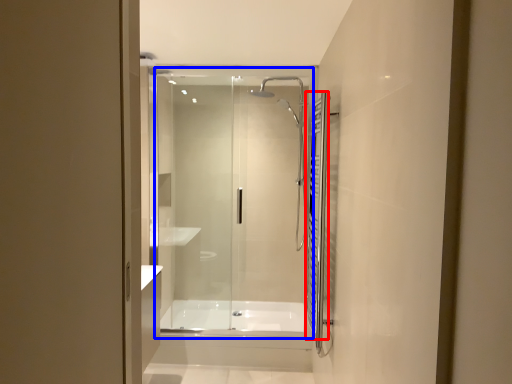
Question: Among these objects, which one is nearest to the camera, shower curtain (highlighted by a red box) or glass door (highlighted by a blue box)?

Choices:
 (A) shower curtain
 (B) glass door

Answer: (A)